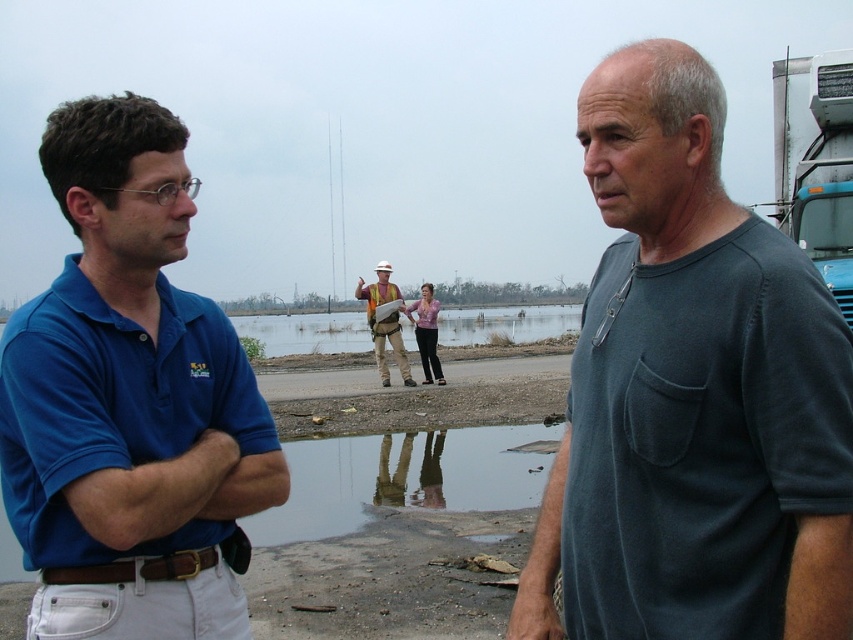
Where is `brown dirt road at center`? This screenshot has width=853, height=640. brown dirt road at center is located at coordinates (306, 332).

Which is in front, point (491, 323) or point (367, 312)?

Point (367, 312)

Identify the location of brown dirt road at center. (306, 332).

Between dark gray t-shirt at center and hard hat construction worker at center, which one has more height?

Standing taller between the two is hard hat construction worker at center.

Does point (619, 481) come behind point (361, 300)?

No, it is not.

Where is `dark gray t-shirt at center`? dark gray t-shirt at center is located at coordinates (692, 394).

Is dark gray t-shirt at center shorter than transparent reflective puddle at center?

In fact, dark gray t-shirt at center may be taller than transparent reflective puddle at center.

Between dark gray t-shirt at center and transparent reflective puddle at center, which one appears on the right side from the viewer's perspective?

From the viewer's perspective, dark gray t-shirt at center appears more on the right side.

Is point (596, 358) behind point (538, 465)?

That is False.

The height and width of the screenshot is (640, 853). In order to click on dark gray t-shirt at center in this screenshot , I will do `click(692, 394)`.